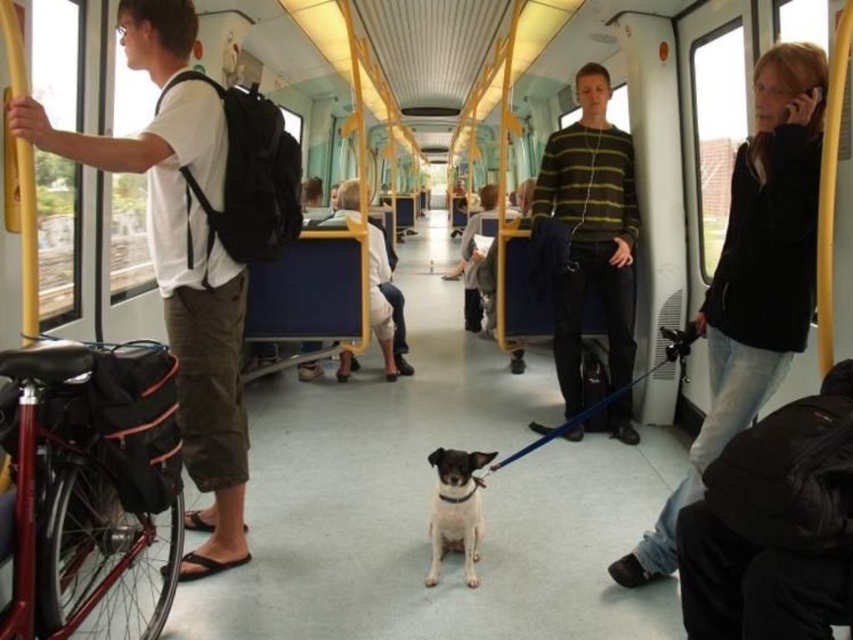
Question: Can you confirm if black leather jacket at upper right is smaller than striped sweater at center?

Choices:
 (A) no
 (B) yes

Answer: (B)

Question: Which object appears farthest from the camera in this image?

Choices:
 (A) striped sweater at center
 (B) white t-shirt at left

Answer: (A)

Question: From the image, what is the correct spatial relationship of black leather jacket at upper right in relation to white t-shirt at left?

Choices:
 (A) above
 (B) below

Answer: (B)

Question: Can you confirm if striped sweater at center is thinner than white smooth dog at center?

Choices:
 (A) no
 (B) yes

Answer: (A)

Question: Which of these objects is positioned closest to the black leather jacket at upper right?

Choices:
 (A) striped sweater at center
 (B) white smooth dog at center

Answer: (B)

Question: Based on their relative distances, which object is nearer to the white smooth dog at center?

Choices:
 (A) white t-shirt at left
 (B) striped sweater at center
 (C) black leather jacket at upper right

Answer: (C)